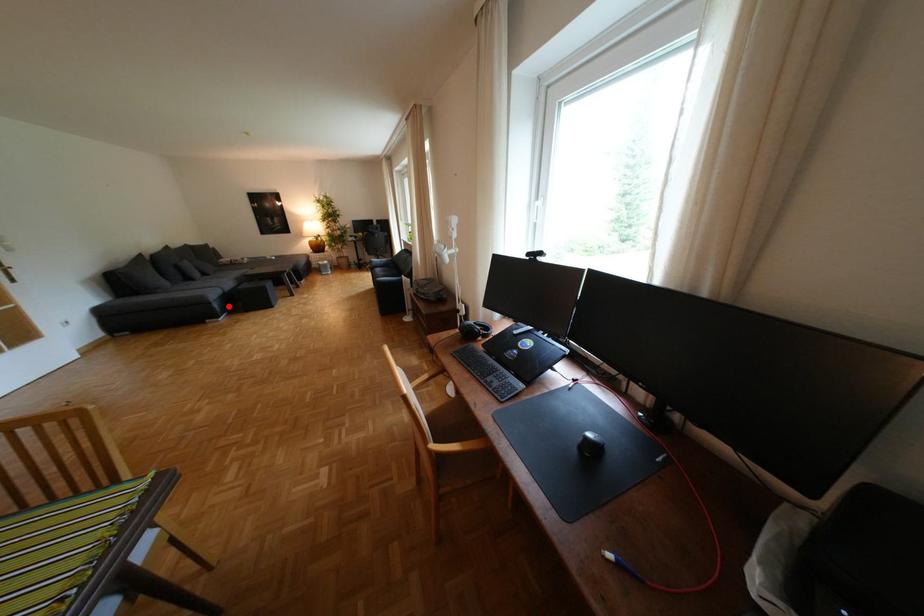
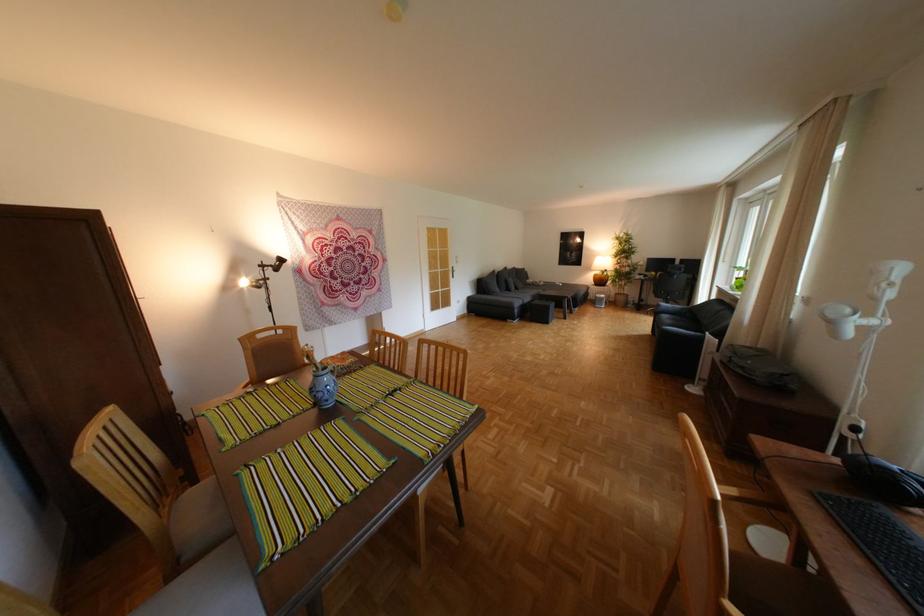
The point at the highlighted location is marked in the first image. Where is the corresponding point in the second image?

(529, 312)